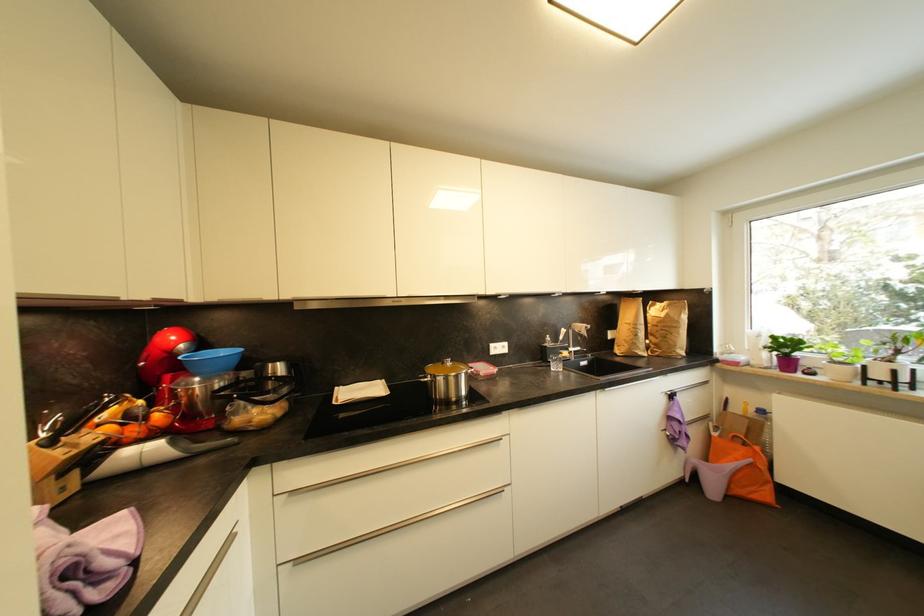
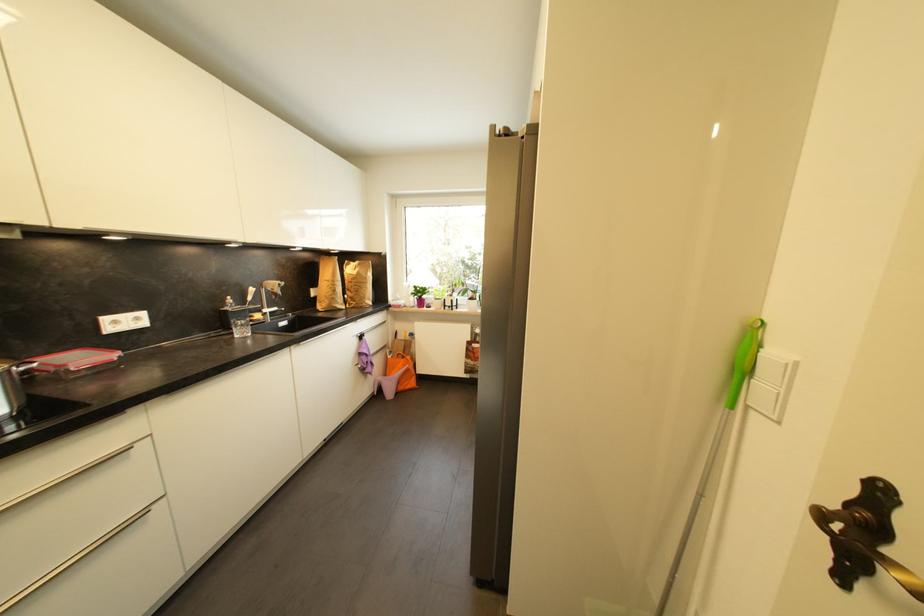
Find the pixel in the second image that matches (x=561, y=369) in the first image.

(247, 334)